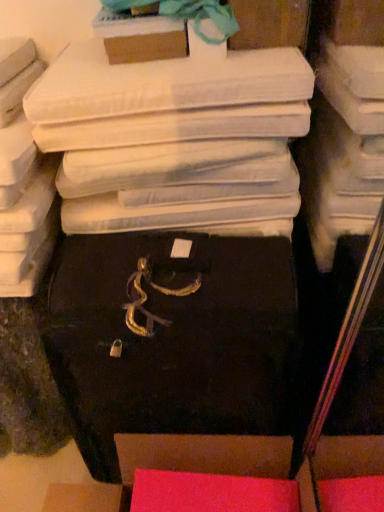
The height and width of the screenshot is (512, 384). Describe the element at coordinates (171, 339) in the screenshot. I see `black matte suitcase at center, which appears as the second storage box when ordered from the bottom` at that location.

How much space does matte cardboard box at upper center, the 2th storage box when ordered from top to bottom, occupy vertically?

3.20 inches.

In order to click on matte cardboard box at upper center, which is the third storage box from bottom to top in this screenshot , I will do `click(140, 37)`.

Consider the image. Measure the distance between matte white storage box at upper center, which is counted as the 4th storage box, starting from the bottom, and camera.

They are 33.66 inches apart.

Image resolution: width=384 pixels, height=512 pixels. What do you see at coordinates (269, 24) in the screenshot?
I see `matte white storage box at upper center, which is counted as the 4th storage box, starting from the bottom` at bounding box center [269, 24].

At what (x,y) coordinates should I click in order to perform the action: click on matte pink box at lower center, marked as the first storage box in a bottom-to-top arrangement. Please return your answer as a coordinate pair (x, y). Looking at the image, I should click on 200,451.

The image size is (384, 512). Find the location of `black matte suitcase at center, the third storage box in the top-to-bottom sequence`. black matte suitcase at center, the third storage box in the top-to-bottom sequence is located at coordinates (171, 339).

Which is in front, point (185, 357) or point (254, 4)?

The point (185, 357) is closer.

Who is shorter, black matte suitcase at center, the third storage box in the top-to-bottom sequence, or matte white storage box at upper center, which appears as the 1th storage box when viewed from the top?

With less height is matte white storage box at upper center, which appears as the 1th storage box when viewed from the top.

Is black matte suitcase at center, which appears as the second storage box when ordered from the bottom, facing away from matte white storage box at upper center, which is counted as the 4th storage box, starting from the bottom?

No, black matte suitcase at center, which appears as the second storage box when ordered from the bottom, is not facing the opposite direction of matte white storage box at upper center, which is counted as the 4th storage box, starting from the bottom.

Considering the positions of objects black matte suitcase at center, which appears as the second storage box when ordered from the bottom, and matte white storage box at upper center, which appears as the 1th storage box when viewed from the top, in the image provided, who is in front, black matte suitcase at center, which appears as the second storage box when ordered from the bottom, or matte white storage box at upper center, which appears as the 1th storage box when viewed from the top,?

black matte suitcase at center, which appears as the second storage box when ordered from the bottom, is more forward.

Based on the photo, from the image's perspective, does matte cardboard box at upper center, which is the third storage box from bottom to top, appear higher than black matte suitcase at center, which appears as the second storage box when ordered from the bottom?

Indeed, from the image's perspective, matte cardboard box at upper center, which is the third storage box from bottom to top, is shown above black matte suitcase at center, which appears as the second storage box when ordered from the bottom.

I want to click on the 2nd storage box behind the black matte suitcase at center, which appears as the second storage box when ordered from the bottom, so click(x=140, y=37).

Is point (132, 41) closer to camera compared to point (112, 316)?

That is False.

Does matte cardboard box at upper center, which is the third storage box from bottom to top, have a greater height compared to black matte suitcase at center, which appears as the second storage box when ordered from the bottom?

No.

Considering their positions, is matte white storage box at upper center, which is counted as the 4th storage box, starting from the bottom, located in front of or behind matte cardboard box at upper center, the 2th storage box when ordered from top to bottom?

matte white storage box at upper center, which is counted as the 4th storage box, starting from the bottom, is behind matte cardboard box at upper center, the 2th storage box when ordered from top to bottom.

Considering the sizes of objects matte white storage box at upper center, which appears as the 1th storage box when viewed from the top, and matte cardboard box at upper center, which is the third storage box from bottom to top, in the image provided, who is wider, matte white storage box at upper center, which appears as the 1th storage box when viewed from the top, or matte cardboard box at upper center, which is the third storage box from bottom to top,?

matte white storage box at upper center, which appears as the 1th storage box when viewed from the top, is wider.

Can matte cardboard box at upper center, the 2th storage box when ordered from top to bottom, be found inside matte white storage box at upper center, which is counted as the 4th storage box, starting from the bottom?

Actually, matte cardboard box at upper center, the 2th storage box when ordered from top to bottom, is outside matte white storage box at upper center, which is counted as the 4th storage box, starting from the bottom.

From the image's perspective, count 1st storage boxs downward from the matte white storage box at upper center, which appears as the 1th storage box when viewed from the top, and point to it. Please provide its 2D coordinates.

[(140, 37)]

From a real-world perspective, is black matte suitcase at center, which appears as the second storage box when ordered from the bottom, positioned over matte pink box at lower center, acting as the 4th storage box starting from the top, based on gravity?

Indeed, from a real-world perspective, black matte suitcase at center, which appears as the second storage box when ordered from the bottom, stands above matte pink box at lower center, acting as the 4th storage box starting from the top.

Which is more to the left, black matte suitcase at center, which appears as the second storage box when ordered from the bottom, or matte pink box at lower center, acting as the 4th storage box starting from the top?

matte pink box at lower center, acting as the 4th storage box starting from the top, is more to the left.

Is black matte suitcase at center, the third storage box in the top-to-bottom sequence, facing towards matte pink box at lower center, acting as the 4th storage box starting from the top?

Yes.

Can you confirm if black matte suitcase at center, which appears as the second storage box when ordered from the bottom, is wider than matte pink box at lower center, acting as the 4th storage box starting from the top?

In fact, black matte suitcase at center, which appears as the second storage box when ordered from the bottom, might be narrower than matte pink box at lower center, acting as the 4th storage box starting from the top.

From the image's perspective, is matte pink box at lower center, acting as the 4th storage box starting from the top, above matte white storage box at upper center, which appears as the 1th storage box when viewed from the top?

Actually, matte pink box at lower center, acting as the 4th storage box starting from the top, appears below matte white storage box at upper center, which appears as the 1th storage box when viewed from the top, in the image.

Is matte pink box at lower center, acting as the 4th storage box starting from the top, outside of matte white storage box at upper center, which appears as the 1th storage box when viewed from the top?

Yes, matte pink box at lower center, acting as the 4th storage box starting from the top, is outside of matte white storage box at upper center, which appears as the 1th storage box when viewed from the top.

Does matte pink box at lower center, acting as the 4th storage box starting from the top, have a lesser width compared to matte white storage box at upper center, which is counted as the 4th storage box, starting from the bottom?

No, matte pink box at lower center, acting as the 4th storage box starting from the top, is not thinner than matte white storage box at upper center, which is counted as the 4th storage box, starting from the bottom.

Is matte pink box at lower center, marked as the first storage box in a bottom-to-top arrangement, facing away from matte white storage box at upper center, which appears as the 1th storage box when viewed from the top?

No.

Is matte cardboard box at upper center, the 2th storage box when ordered from top to bottom, oriented away from matte white storage box at upper center, which is counted as the 4th storage box, starting from the bottom?

That's not correct — matte cardboard box at upper center, the 2th storage box when ordered from top to bottom, is not looking away from matte white storage box at upper center, which is counted as the 4th storage box, starting from the bottom.

Is matte cardboard box at upper center, which is the third storage box from bottom to top, shorter than matte white storage box at upper center, which appears as the 1th storage box when viewed from the top?

Indeed, matte cardboard box at upper center, which is the third storage box from bottom to top, has a lesser height compared to matte white storage box at upper center, which appears as the 1th storage box when viewed from the top.

Considering the positions of point (160, 50) and point (284, 20), is point (160, 50) closer or farther from the camera than point (284, 20)?

Point (160, 50) is farther from the camera than point (284, 20).

Are matte cardboard box at upper center, which is the third storage box from bottom to top, and matte white storage box at upper center, which is counted as the 4th storage box, starting from the bottom, far apart?

matte cardboard box at upper center, which is the third storage box from bottom to top, is actually quite close to matte white storage box at upper center, which is counted as the 4th storage box, starting from the bottom.

In the scene shown: From a real-world perspective, is matte pink box at lower center, marked as the first storage box in a bottom-to-top arrangement, over matte cardboard box at upper center, the 2th storage box when ordered from top to bottom?

No.

Could you tell me if matte pink box at lower center, marked as the first storage box in a bottom-to-top arrangement, is turned towards matte cardboard box at upper center, which is the third storage box from bottom to top?

No, matte pink box at lower center, marked as the first storage box in a bottom-to-top arrangement, is not oriented towards matte cardboard box at upper center, which is the third storage box from bottom to top.

Can you tell me how much matte pink box at lower center, marked as the first storage box in a bottom-to-top arrangement, and matte cardboard box at upper center, the 2th storage box when ordered from top to bottom, differ in facing direction?

They differ by 90.7 degrees in their facing directions.

From the image's perspective, is matte pink box at lower center, marked as the first storage box in a bottom-to-top arrangement, beneath matte cardboard box at upper center, the 2th storage box when ordered from top to bottom?

Yes, from the image's perspective, matte pink box at lower center, marked as the first storage box in a bottom-to-top arrangement, is beneath matte cardboard box at upper center, the 2th storage box when ordered from top to bottom.

From a real-world perspective, which storage box is the 2nd one underneath the matte white storage box at upper center, which appears as the 1th storage box when viewed from the top? Please provide its 2D coordinates.

[(171, 339)]

Find the location of `the 1st storage box above the black matte suitcase at center, which appears as the second storage box when ordered from the bottom (from the image's perspective)`. the 1st storage box above the black matte suitcase at center, which appears as the second storage box when ordered from the bottom (from the image's perspective) is located at coordinates (140, 37).

Looking at the image, which one is located further to matte white storage box at upper center, which is counted as the 4th storage box, starting from the bottom, black matte suitcase at center, the third storage box in the top-to-bottom sequence, or matte cardboard box at upper center, which is the third storage box from bottom to top?

The object further to matte white storage box at upper center, which is counted as the 4th storage box, starting from the bottom, is black matte suitcase at center, the third storage box in the top-to-bottom sequence.

When comparing their distances from black matte suitcase at center, the third storage box in the top-to-bottom sequence, does matte pink box at lower center, acting as the 4th storage box starting from the top, or matte cardboard box at upper center, which is the third storage box from bottom to top, seem further?

matte cardboard box at upper center, which is the third storage box from bottom to top, lies further to black matte suitcase at center, the third storage box in the top-to-bottom sequence, than the other object.

Based on the photo, from the image, which object appears to be nearer to matte cardboard box at upper center, which is the third storage box from bottom to top, matte white storage box at upper center, which is counted as the 4th storage box, starting from the bottom, or black matte suitcase at center, the third storage box in the top-to-bottom sequence?

Among the two, matte white storage box at upper center, which is counted as the 4th storage box, starting from the bottom, is located nearer to matte cardboard box at upper center, which is the third storage box from bottom to top.

Which object lies further to the anchor point matte pink box at lower center, marked as the first storage box in a bottom-to-top arrangement, black matte suitcase at center, the third storage box in the top-to-bottom sequence, or matte cardboard box at upper center, the 2th storage box when ordered from top to bottom?

The object further to matte pink box at lower center, marked as the first storage box in a bottom-to-top arrangement, is matte cardboard box at upper center, the 2th storage box when ordered from top to bottom.

Looking at the image, which one is located further to matte pink box at lower center, marked as the first storage box in a bottom-to-top arrangement, black matte suitcase at center, which appears as the second storage box when ordered from the bottom, or matte white storage box at upper center, which appears as the 1th storage box when viewed from the top?

The object further to matte pink box at lower center, marked as the first storage box in a bottom-to-top arrangement, is matte white storage box at upper center, which appears as the 1th storage box when viewed from the top.

From the image, which object appears to be farther from matte white storage box at upper center, which appears as the 1th storage box when viewed from the top, matte cardboard box at upper center, the 2th storage box when ordered from top to bottom, or black matte suitcase at center, the third storage box in the top-to-bottom sequence?

black matte suitcase at center, the third storage box in the top-to-bottom sequence, lies further to matte white storage box at upper center, which appears as the 1th storage box when viewed from the top, than the other object.

Looking at the image, which one is located closer to black matte suitcase at center, which appears as the second storage box when ordered from the bottom, matte cardboard box at upper center, the 2th storage box when ordered from top to bottom, or matte white storage box at upper center, which appears as the 1th storage box when viewed from the top?

matte cardboard box at upper center, the 2th storage box when ordered from top to bottom, is positioned closer to the anchor black matte suitcase at center, which appears as the second storage box when ordered from the bottom.

Based on their spatial positions, is matte pink box at lower center, acting as the 4th storage box starting from the top, or matte cardboard box at upper center, which is the third storage box from bottom to top, further from matte white storage box at upper center, which appears as the 1th storage box when viewed from the top?

Based on the image, matte pink box at lower center, acting as the 4th storage box starting from the top, appears to be further to matte white storage box at upper center, which appears as the 1th storage box when viewed from the top.

What are the coordinates of `storage box between matte white storage box at upper center, which is counted as the 4th storage box, starting from the bottom, and black matte suitcase at center, the third storage box in the top-to-bottom sequence, in the up-down direction` in the screenshot? It's located at (140, 37).

The image size is (384, 512). In order to click on storage box that lies between matte cardboard box at upper center, the 2th storage box when ordered from top to bottom, and matte pink box at lower center, marked as the first storage box in a bottom-to-top arrangement, from top to bottom in this screenshot , I will do `click(171, 339)`.